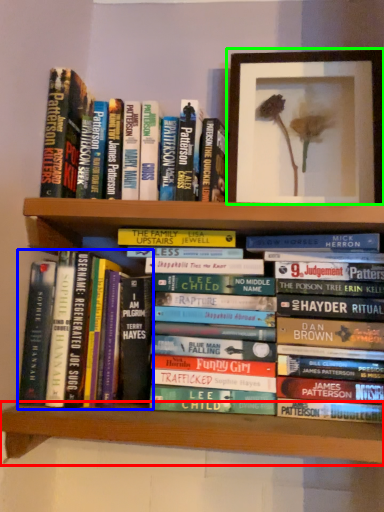
Question: Estimate the real-world distances between objects in this image. Which object is closer to shelf (highlighted by a red box), book (highlighted by a blue box) or picture frame (highlighted by a green box)?

Choices:
 (A) book
 (B) picture frame

Answer: (A)